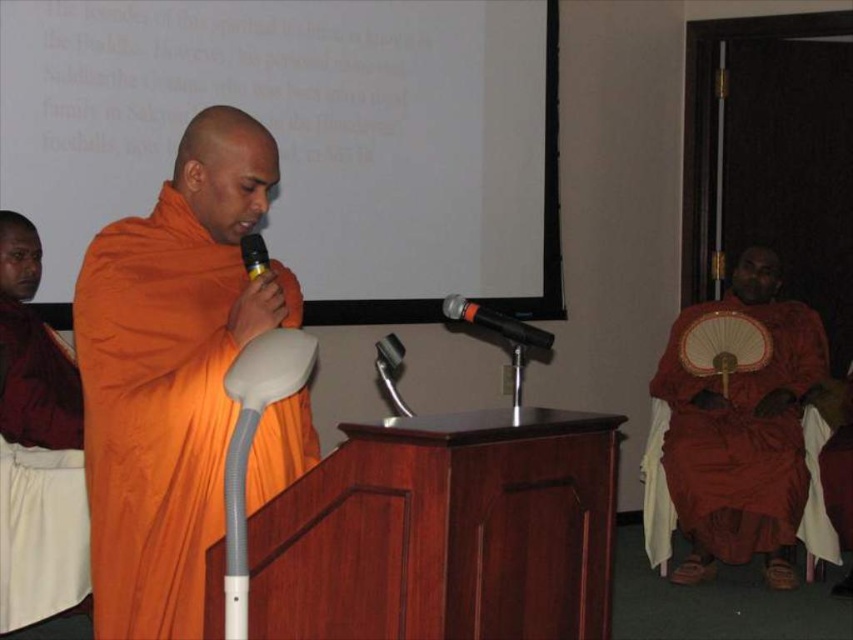
Question: Which object appears closest to the camera in this image?

Choices:
 (A) matte orange robe at right
 (B) orange silk robe at left
 (C) black metallic microphone at center
 (D) orange silk robe at center

Answer: (D)

Question: Which point is closer to the camera?

Choices:
 (A) matte orange robe at right
 (B) orange silk robe at center
 (C) orange silk robe at left
 (D) black metallic microphone at center

Answer: (B)

Question: Which of the following is the farthest from the observer?

Choices:
 (A) black metallic microphone at center
 (B) orange silk robe at center
 (C) orange silk robe at left
 (D) matte orange robe at right

Answer: (D)

Question: Does orange silk robe at center appear on the right side of black metallic microphone at center?

Choices:
 (A) no
 (B) yes

Answer: (A)

Question: Does matte orange robe at right appear under orange silk robe at left?

Choices:
 (A) yes
 (B) no

Answer: (A)

Question: Can you confirm if orange silk robe at center is thinner than black metallic microphone at center?

Choices:
 (A) no
 (B) yes

Answer: (A)